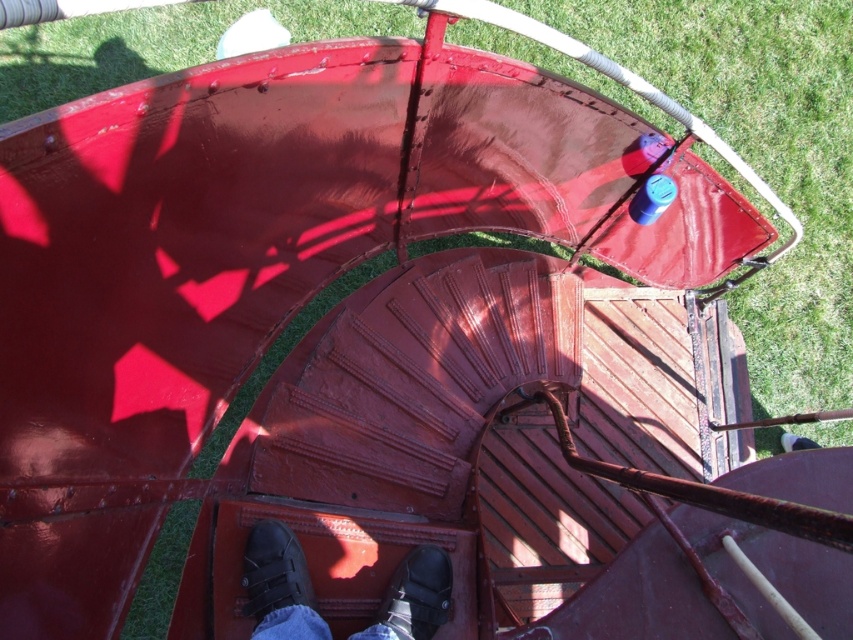
Question: Does black leather shoes at center appear on the left side of black leather shoe at lower center?

Choices:
 (A) yes
 (B) no

Answer: (A)

Question: Is green grass at upper center bigger than rusty metal stairs at center?

Choices:
 (A) yes
 (B) no

Answer: (B)

Question: Estimate the real-world distances between objects in this image. Which object is farther from the black leather shoe at center?

Choices:
 (A) black leather shoes at center
 (B) green grass at upper center
 (C) rusty metal stairs at center

Answer: (B)

Question: Which of these objects is positioned farthest from the black leather shoe at center?

Choices:
 (A) black leather shoes at center
 (B) rusty metal stairs at center
 (C) black leather shoe at lower center

Answer: (B)

Question: Is green grass at upper center bigger than black leather shoe at lower center?

Choices:
 (A) yes
 (B) no

Answer: (A)

Question: Considering the real-world distances, which object is closest to the green grass at upper center?

Choices:
 (A) black leather shoe at lower center
 (B) rusty metal stairs at center

Answer: (B)